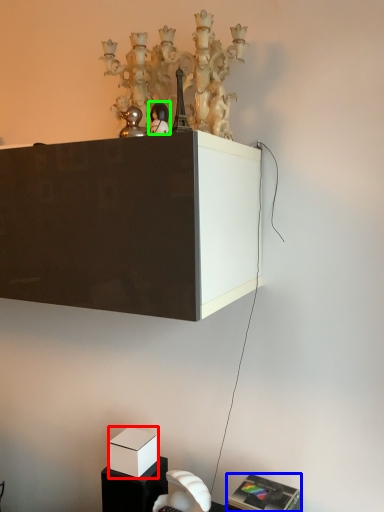
Question: Based on their relative distances, which object is farther from box (highlighted by a red box)? Choose from furniture (highlighted by a blue box) and toy (highlighted by a green box).

Choices:
 (A) furniture
 (B) toy

Answer: (B)